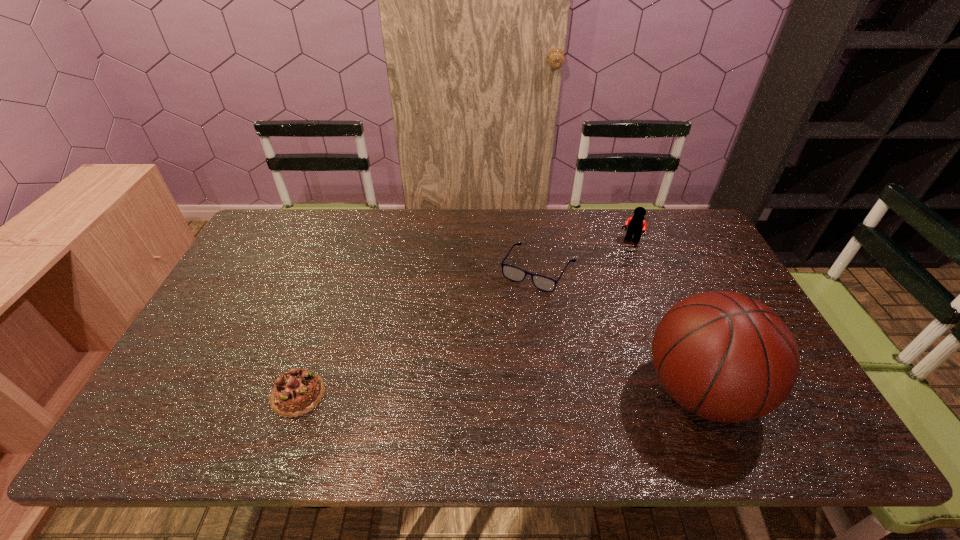
Locate an element on the screen. vacant spot on the desktop that is between the leftmost object and the tallest object and is positioned on the front-facing side of the spectacles is located at coordinates (x=467, y=393).

This screenshot has width=960, height=540. I want to click on free space on the desktop that is between the leftmost object and the tallest object and is positioned on the front-facing side of the third shortest object, so click(x=526, y=392).